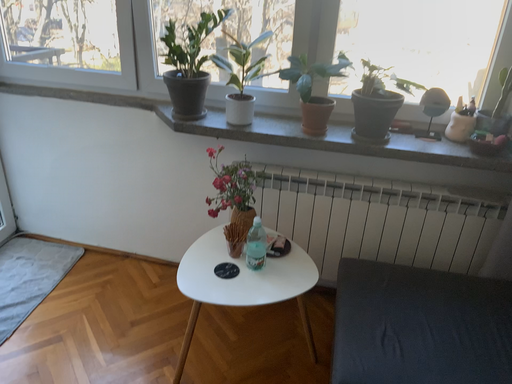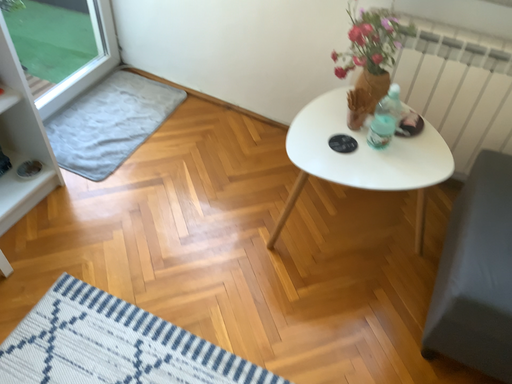
Question: How did the camera likely rotate when shooting the video?

Choices:
 (A) rotated left
 (B) rotated right

Answer: (A)